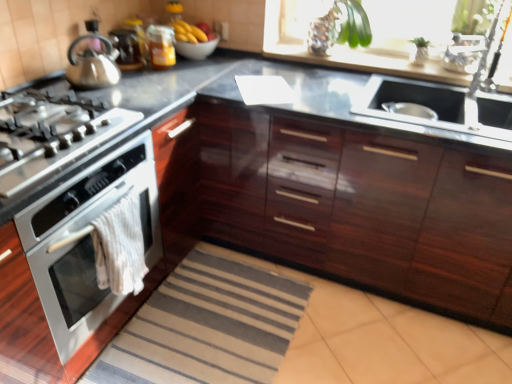
Find the location of a particular element. Image resolution: width=512 pixels, height=384 pixels. vacant space situated above glossy wood cabinetry at center (from a real-world perspective) is located at coordinates (324, 86).